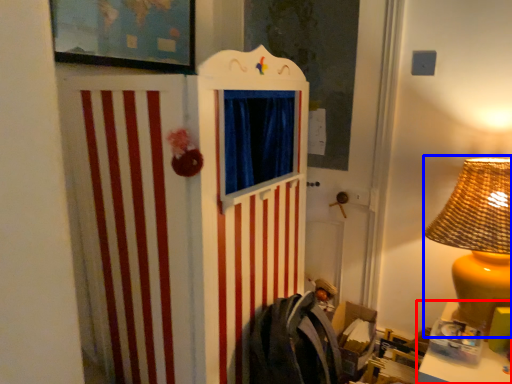
Question: Which object is further to the camera taking this photo, table (highlighted by a red box) or table lamp (highlighted by a blue box)?

Choices:
 (A) table
 (B) table lamp

Answer: (B)